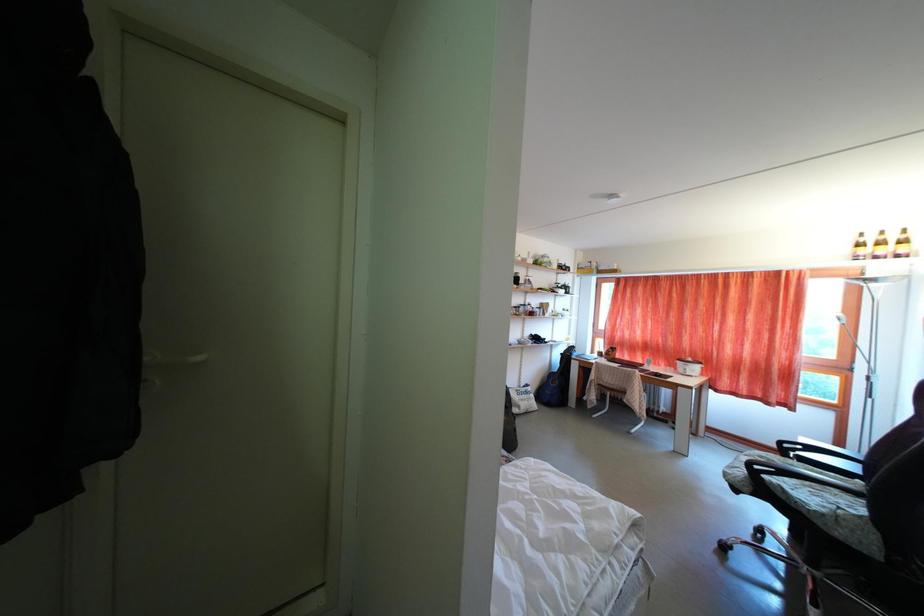
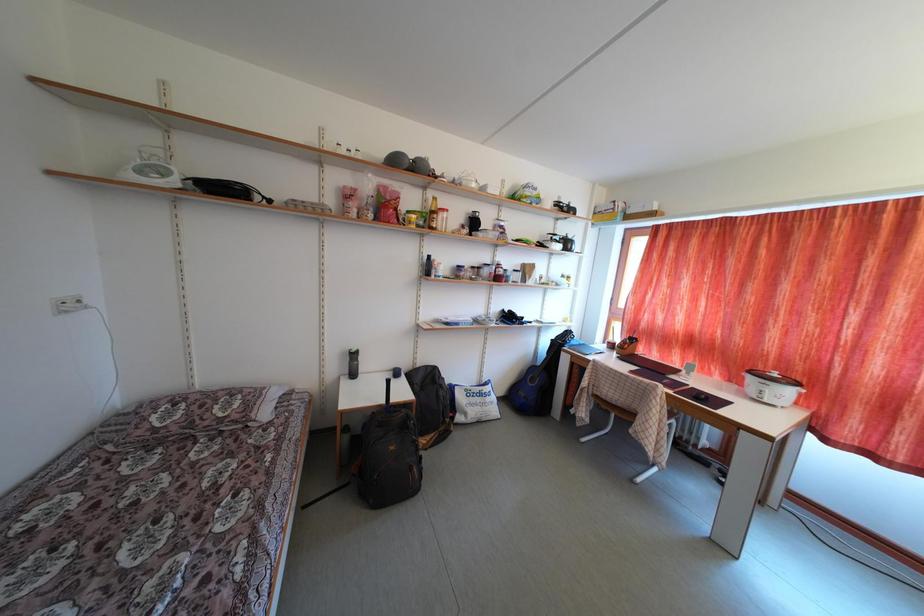
The images are taken continuously from a first-person perspective. In which direction are you moving?

The movement direction of the cameraman is right, forward.